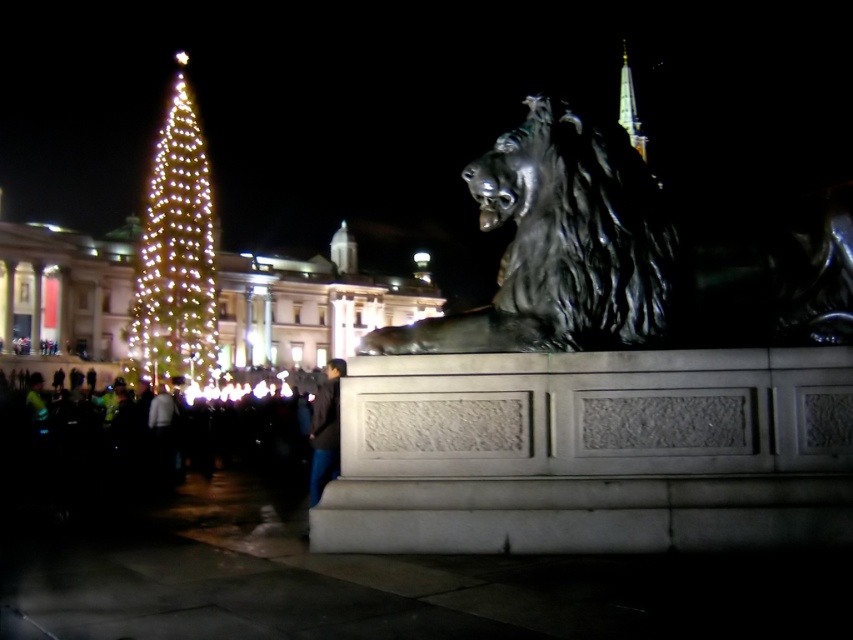
Question: From the image, what is the correct spatial relationship of polished bronze lion at center in relation to dark gray jacket at lower center?

Choices:
 (A) right
 (B) left

Answer: (A)

Question: Which point appears closest to the camera in this image?

Choices:
 (A) (141, 371)
 (B) (309, 502)

Answer: (B)

Question: Which is farther from the illuminated glass christmas tree at left?

Choices:
 (A) dark gray jacket at lower center
 (B) polished bronze lion at center

Answer: (B)

Question: Does polished bronze lion at center lie behind dark gray jacket at lower center?

Choices:
 (A) yes
 (B) no

Answer: (B)

Question: Which is farther from the dark gray jacket at lower center?

Choices:
 (A) polished bronze lion at center
 (B) illuminated glass christmas tree at left

Answer: (B)

Question: Where is polished bronze lion at center located in relation to dark gray jacket at lower center in the image?

Choices:
 (A) left
 (B) right

Answer: (B)